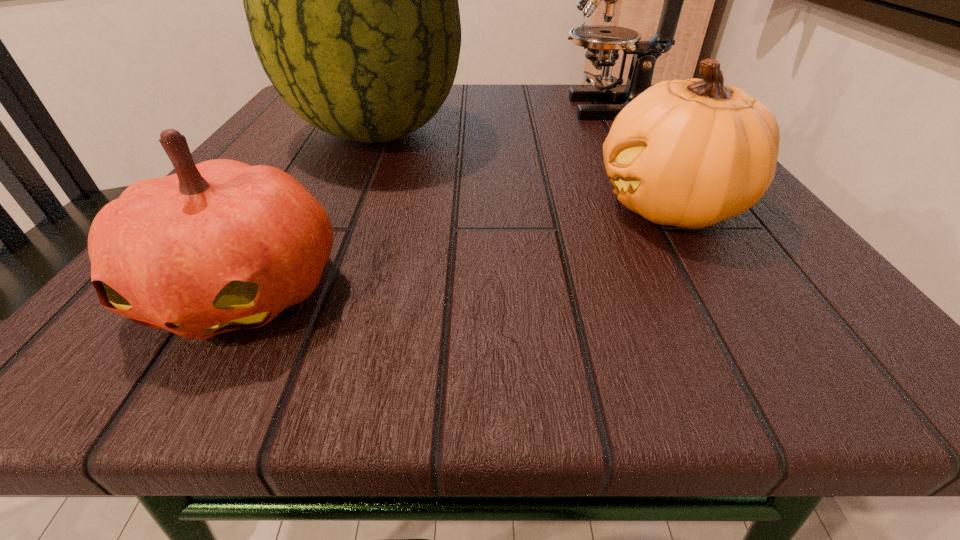
Identify the location of object that is at the far right corner. (603, 42).

The height and width of the screenshot is (540, 960). I want to click on vacant space at the far edge, so click(x=455, y=112).

The width and height of the screenshot is (960, 540). In the image, there is a desktop. What are the coordinates of `vacant region at the near edge` in the screenshot? It's located at (492, 303).

You are a GUI agent. You are given a task and a screenshot of the screen. Output one action in this format:
    pyautogui.click(x=<x>, y=<y>)
    Task: Click on the vacant space at the left edge of the desktop
    The image size is (960, 540).
    Given the screenshot: What is the action you would take?
    pyautogui.click(x=285, y=168)

Locate an element on the screen. This screenshot has width=960, height=540. free region at the far left corner is located at coordinates (298, 120).

You are a GUI agent. You are given a task and a screenshot of the screen. Output one action in this format:
    pyautogui.click(x=<x>, y=<y>)
    Task: Click on the vacant region between the microscope and the left pumpkin
    
    Given the screenshot: What is the action you would take?
    pyautogui.click(x=429, y=199)

You are a GUI agent. You are given a task and a screenshot of the screen. Output one action in this format:
    pyautogui.click(x=<x>, y=<y>)
    Task: Click on the free spot between the right pumpkin and the watermelon
    The width and height of the screenshot is (960, 540).
    Given the screenshot: What is the action you would take?
    pyautogui.click(x=523, y=170)

Where is `vacant point located between the watermelon and the microscope`? The image size is (960, 540). vacant point located between the watermelon and the microscope is located at coordinates (496, 120).

Identify the location of free space that is in between the left pumpkin and the microscope. (429, 199).

At what (x,y) coordinates should I click in order to perform the action: click on free space between the watermelon and the right pumpkin. Please return your answer as a coordinate pair (x, y). Looking at the image, I should click on (523, 170).